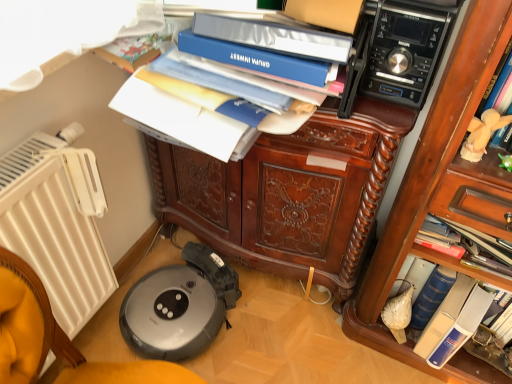
Find the location of `vacant region above white plastic radiator at left (from a real-world perspective)`. vacant region above white plastic radiator at left (from a real-world perspective) is located at coordinates (34, 155).